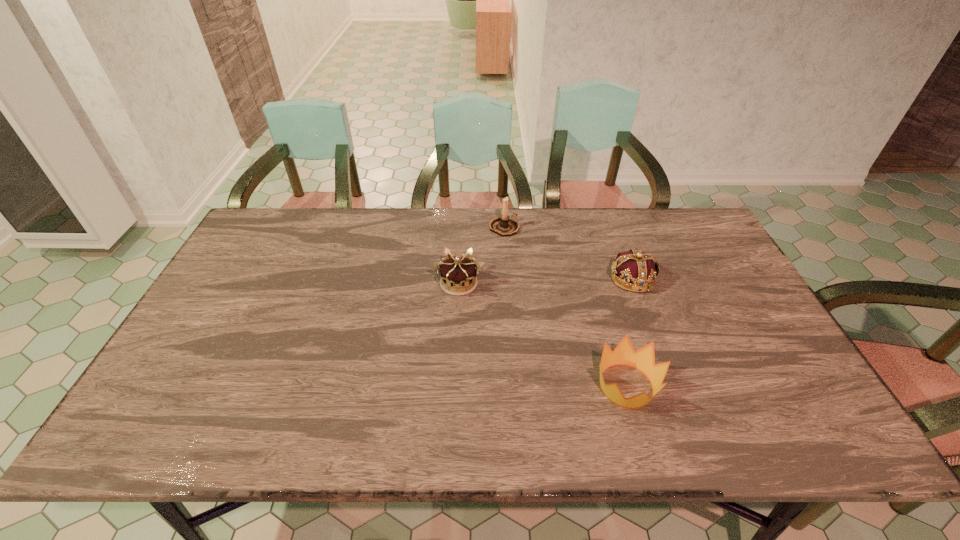
Find the location of `vacant space at the near edge of the desktop`. vacant space at the near edge of the desktop is located at coordinates (267, 446).

Image resolution: width=960 pixels, height=540 pixels. I want to click on vacant space at the left edge, so click(239, 316).

You are a GUI agent. You are given a task and a screenshot of the screen. Output one action in this format:
    pyautogui.click(x=<x>, y=<y>)
    Task: Click on the free space at the far left corner
    
    Given the screenshot: What is the action you would take?
    pyautogui.click(x=293, y=228)

The image size is (960, 540). In order to click on vacant area between the nearest object and the candle holder in this screenshot , I will do `click(565, 307)`.

At what (x,y) coordinates should I click in order to perform the action: click on vacant area that lies between the farthest object and the nearest object. Please return your answer as a coordinate pair (x, y). Looking at the image, I should click on (565, 307).

At what (x,y) coordinates should I click in order to perform the action: click on empty space that is in between the second object from left to right and the nearest crown. Please return your answer as a coordinate pair (x, y). This screenshot has width=960, height=540. Looking at the image, I should click on (565, 307).

This screenshot has width=960, height=540. I want to click on free spot between the leftmost object and the farthest object, so click(x=482, y=255).

Where is `vacant area that lies between the nearest object and the leftmost object`? This screenshot has width=960, height=540. vacant area that lies between the nearest object and the leftmost object is located at coordinates [542, 335].

What are the coordinates of `free space between the nearest object and the leftmost object` in the screenshot? It's located at [542, 335].

Locate an element on the screen. the third closest object relative to the candle holder is located at coordinates (643, 359).